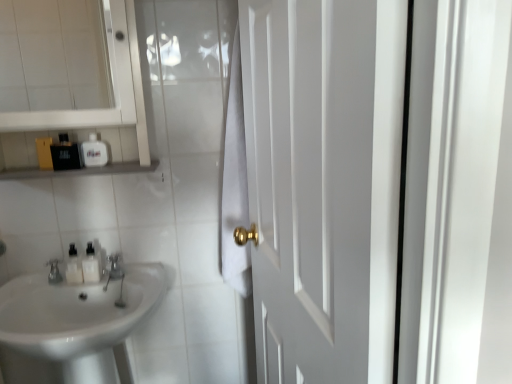
This screenshot has height=384, width=512. I want to click on vacant region to the left of white glossy bottles at left, which is the 1th toiletry from bottom to top, so click(25, 276).